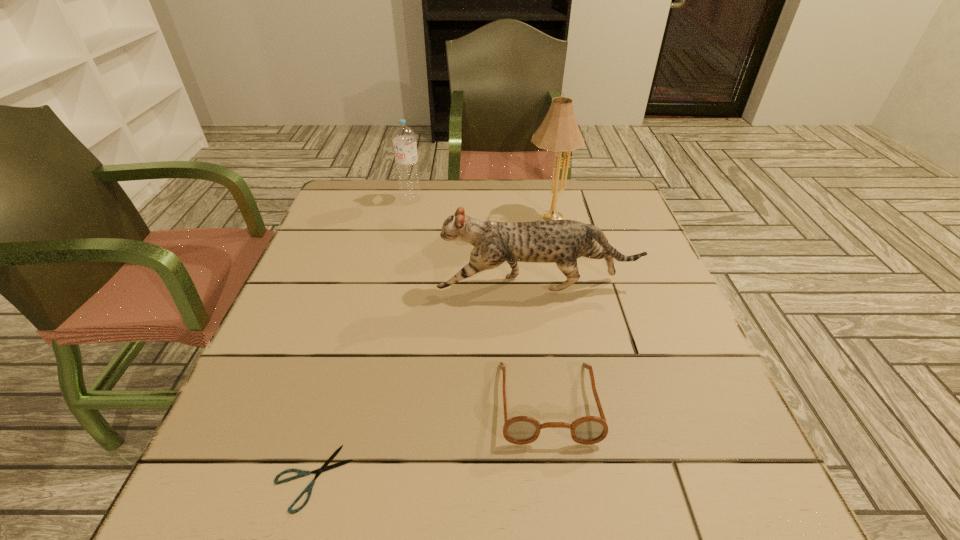
This screenshot has width=960, height=540. Find the location of `vacant space located on the face of the third nearest object`. vacant space located on the face of the third nearest object is located at coordinates (411, 286).

Where is `free space located 0.110m on the front-facing side of the spectacles`? free space located 0.110m on the front-facing side of the spectacles is located at coordinates (564, 518).

Where is `lampshade that is at the far edge`? lampshade that is at the far edge is located at coordinates (559, 132).

At what (x,y) coordinates should I click in order to perform the action: click on water bottle located at the far edge. Please return your answer as a coordinate pair (x, y). The width and height of the screenshot is (960, 540). Looking at the image, I should click on pos(404,138).

The image size is (960, 540). Find the location of `object that is at the near edge`. object that is at the near edge is located at coordinates (324, 468).

Find the location of a particular element. The width and height of the screenshot is (960, 540). object that is at the left edge is located at coordinates coord(324,468).

The width and height of the screenshot is (960, 540). What are the coordinates of `object located in the right edge section of the desktop` in the screenshot? It's located at (562, 241).

Find the location of a particular element. The height and width of the screenshot is (540, 960). object that is positioned at the near left corner is located at coordinates (324, 468).

You are a GUI agent. You are given a task and a screenshot of the screen. Output one action in this format:
    pyautogui.click(x=<x>, y=<y>)
    Task: Click on the vacant point at the far edge
    The height and width of the screenshot is (540, 960).
    Given the screenshot: What is the action you would take?
    pyautogui.click(x=467, y=197)

In the image, there is a desktop. Find the location of `vacant area at the left edge`. vacant area at the left edge is located at coordinates (329, 285).